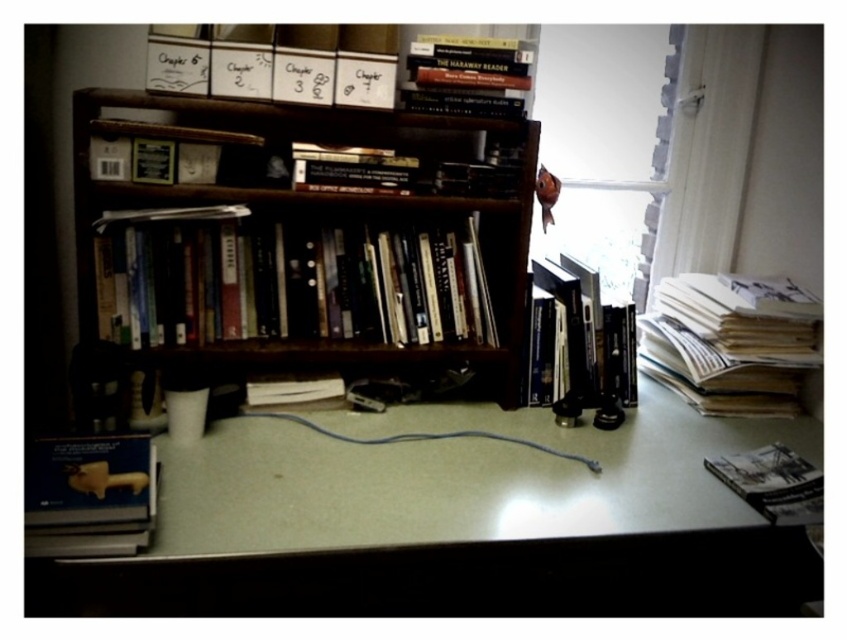
You are organizing the study area and want to place a new item on the shelf. The new item requires a larger surface area than the white paper stack at right. Can the matte black book at lower right accommodate the new item?

The white paper stack at right has a larger size compared to the matte black book at lower right. Therefore, the matte black book at lower right cannot accommodate the new item since it is smaller than the required surface area.

You are organizing the study area and need to decide which item to move first. Based on their heights, which item is taller between the white paper stack at right and the matte black book at lower right?

The white paper stack at right is much taller than the matte black book at lower right, so you should move the white paper stack at right first to free up more space.

You are organizing the study area and notice the white paper stack at right and the matte black book at lower right. Which item is positioned further to the east side of the room?

The matte black book at lower right is positioned further to the east side of the room because the white paper stack at right is to the right of it, meaning the matte black book is to the left, which would be the eastern direction if the room is oriented with the window to the right side facing east.